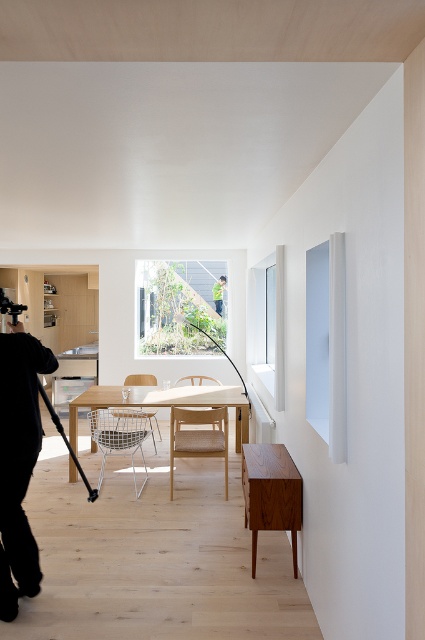
Is black fabric camera at left bigger than matte black tripod at lower left?

No.

Does black fabric camera at left have a greater height compared to matte black tripod at lower left?

Yes.

Does point (42, 349) come farther from viewer compared to point (64, 438)?

No.

Identify the location of black fabric camera at left. (19, 461).

Is matte black tripod at lower left thinner than green fabric shirt at upper center?

Incorrect, matte black tripod at lower left's width is not less than green fabric shirt at upper center's.

Can you confirm if matte black tripod at lower left is bigger than green fabric shirt at upper center?

Yes.

The width and height of the screenshot is (425, 640). I want to click on matte black tripod at lower left, so click(65, 442).

Is black fabric camera at left smaller than green fabric shirt at upper center?

No.

Does black fabric camera at left have a larger size compared to green fabric shirt at upper center?

Indeed, black fabric camera at left has a larger size compared to green fabric shirt at upper center.

Describe the element at coordinates (19, 461) in the screenshot. Image resolution: width=425 pixels, height=640 pixels. I see `black fabric camera at left` at that location.

Where is `black fabric camera at left`? This screenshot has height=640, width=425. black fabric camera at left is located at coordinates (19, 461).